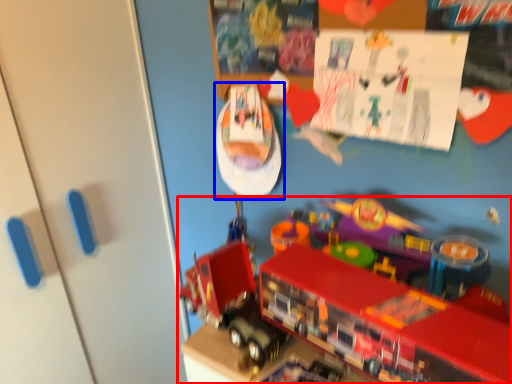
Question: Which point is further to the camera, toy (highlighted by a red box) or toy (highlighted by a blue box)?

Choices:
 (A) toy
 (B) toy

Answer: (B)